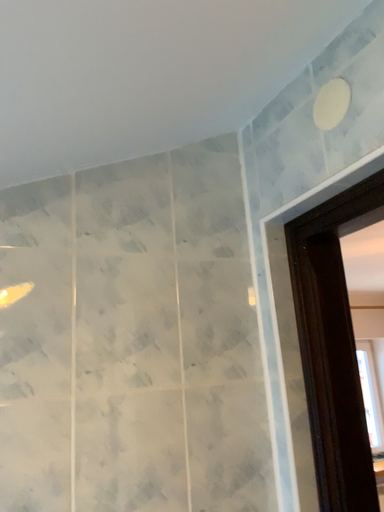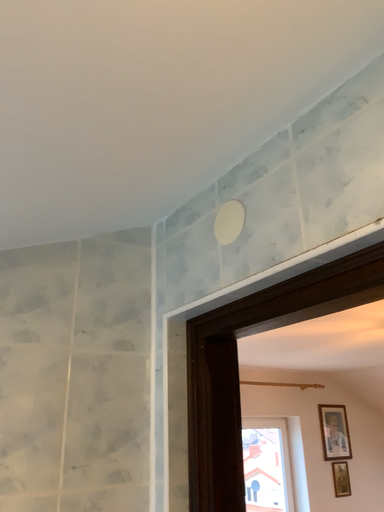
Question: Which way did the camera rotate in the video?

Choices:
 (A) rotated upward
 (B) rotated downward

Answer: (A)